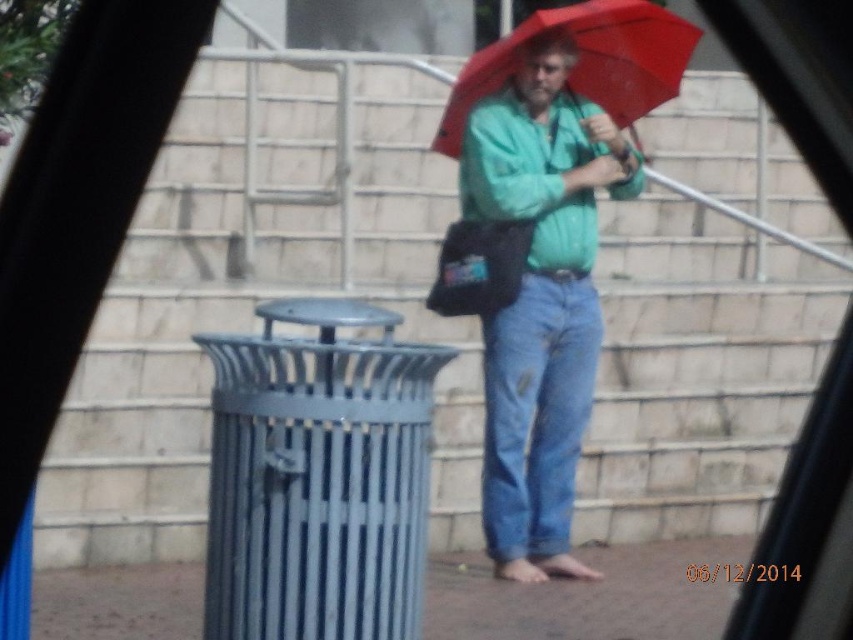
Is green matte shirt at center in front of red matte umbrella at center?

No, it is not.

Based on the photo, is green matte shirt at center above red matte umbrella at center?

No.

Who is more distant from viewer, (515, 76) or (590, 49)?

Positioned behind is point (590, 49).

This screenshot has height=640, width=853. I want to click on green matte shirt at center, so click(541, 300).